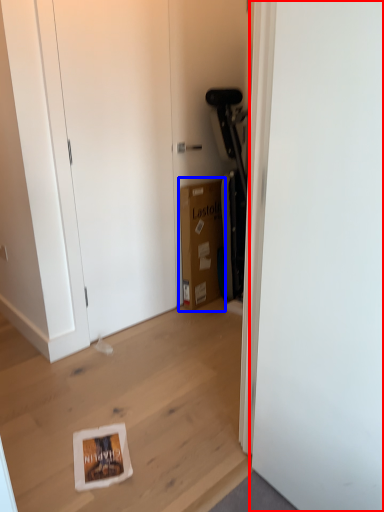
Question: Which object is further to the camera taking this photo, door (highlighted by a red box) or cardboard box (highlighted by a blue box)?

Choices:
 (A) door
 (B) cardboard box

Answer: (B)